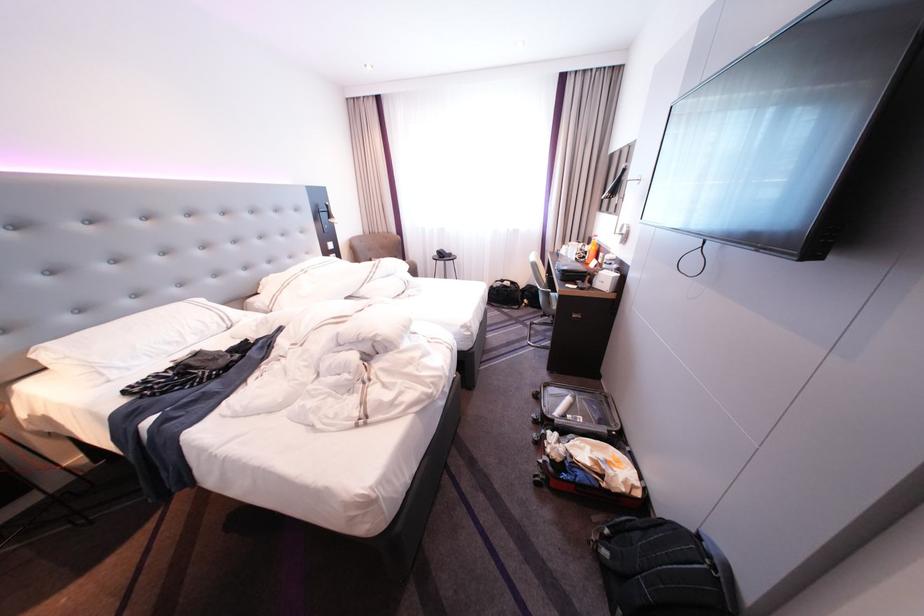
At what (x,y) coordinates should I click in order to perform the action: click on orange plastic bottle. Please return your answer as a coordinate pair (x, y). The height and width of the screenshot is (616, 924). Looking at the image, I should click on (591, 252).